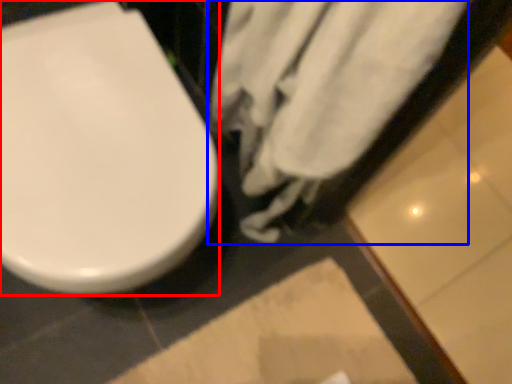
Question: Which point is closer to the camera, toilet (highlighted by a red box) or bath towel (highlighted by a blue box)?

Choices:
 (A) toilet
 (B) bath towel

Answer: (B)